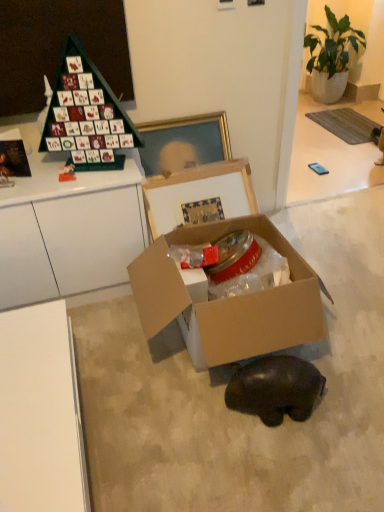
Question: From the image's perspective, is black matte bear at lower center located beneath green matte advent calendar at upper left?

Choices:
 (A) yes
 (B) no

Answer: (A)

Question: Is black matte bear at lower center at the right side of green matte advent calendar at upper left?

Choices:
 (A) yes
 (B) no

Answer: (A)

Question: Is green matte advent calendar at upper left at the back of black matte bear at lower center?

Choices:
 (A) no
 (B) yes

Answer: (A)

Question: From a real-world perspective, is black matte bear at lower center physically below green matte advent calendar at upper left?

Choices:
 (A) no
 (B) yes

Answer: (B)

Question: Could you tell me if black matte bear at lower center is facing green matte advent calendar at upper left?

Choices:
 (A) yes
 (B) no

Answer: (B)

Question: Considering the relative positions of green leafy plant in pot at upper right and cardboard box at center in the image provided, is green leafy plant in pot at upper right to the left or to the right of cardboard box at center?

Choices:
 (A) right
 (B) left

Answer: (A)

Question: Is green leafy plant in pot at upper right in front of or behind cardboard box at center in the image?

Choices:
 (A) front
 (B) behind

Answer: (B)

Question: Considering the positions of green leafy plant in pot at upper right and cardboard box at center in the image, is green leafy plant in pot at upper right wider or thinner than cardboard box at center?

Choices:
 (A) wide
 (B) thin

Answer: (B)

Question: From the image's perspective, is green leafy plant in pot at upper right located above or below cardboard box at center?

Choices:
 (A) below
 (B) above

Answer: (B)

Question: From the image's perspective, is green leafy plant in pot at upper right above or below black matte bear at lower center?

Choices:
 (A) below
 (B) above

Answer: (B)

Question: Looking at the image, does green leafy plant in pot at upper right seem bigger or smaller compared to black matte bear at lower center?

Choices:
 (A) big
 (B) small

Answer: (A)

Question: Based on their positions, is green leafy plant in pot at upper right located to the left or right of black matte bear at lower center?

Choices:
 (A) left
 (B) right

Answer: (B)

Question: From a real-world perspective, is green leafy plant in pot at upper right above or below black matte bear at lower center?

Choices:
 (A) below
 (B) above

Answer: (B)

Question: Is black matte bear at lower center taller or shorter than green matte advent calendar at upper left?

Choices:
 (A) short
 (B) tall

Answer: (A)

Question: From a real-world perspective, relative to green matte advent calendar at upper left, is black matte bear at lower center vertically above or below?

Choices:
 (A) above
 (B) below

Answer: (B)